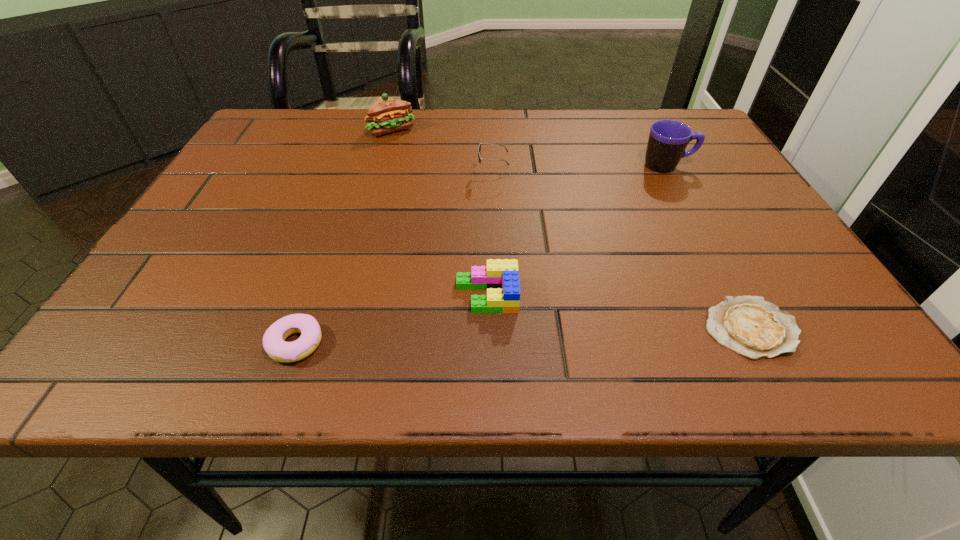
Locate an element on the screen. The height and width of the screenshot is (540, 960). free spot that satisfies the following two spatial constraints: 1. on the back side of the shortest object; 2. in front of the lenses of the fourth shortest object is located at coordinates (668, 174).

The image size is (960, 540). I want to click on vacant space that satisfies the following two spatial constraints: 1. on the back side of the third shortest object; 2. on the left side of the doughnut, so click(313, 295).

You are a GUI agent. You are given a task and a screenshot of the screen. Output one action in this format:
    pyautogui.click(x=<x>, y=<y>)
    Task: Click on the free location that satisfies the following two spatial constraints: 1. with the handle on the side of the mug; 2. on the front side of the shortest object
    
    Given the screenshot: What is the action you would take?
    pyautogui.click(x=756, y=328)

Where is `blank area in the image that satisfies the following two spatial constraints: 1. on the back side of the shortest object; 2. in front of the lenses of the sunglasses`? blank area in the image that satisfies the following two spatial constraints: 1. on the back side of the shortest object; 2. in front of the lenses of the sunglasses is located at coordinates (668, 174).